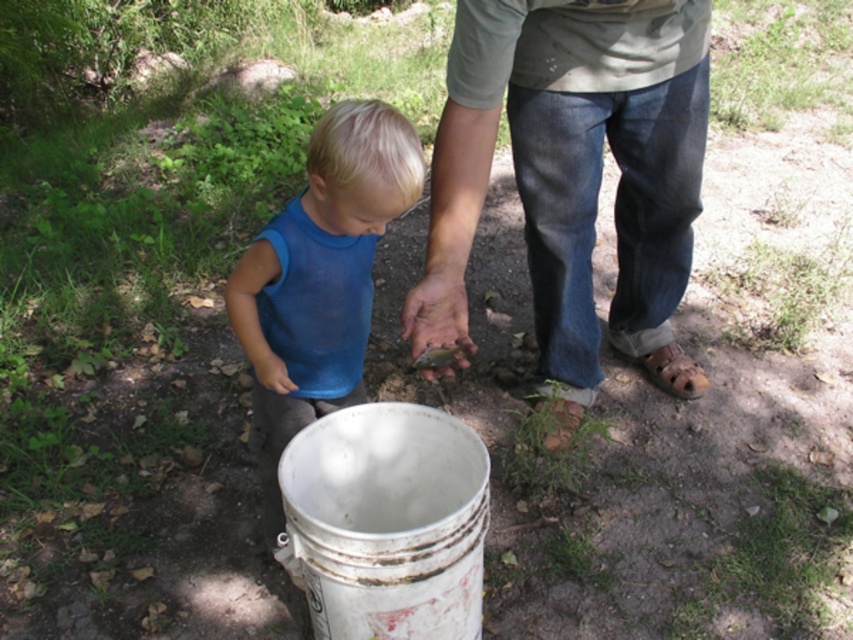
Who is taller, denim jeans at center or blue mesh shirt at center?

denim jeans at center is taller.

Describe the element at coordinates (573, 176) in the screenshot. The width and height of the screenshot is (853, 640). I see `denim jeans at center` at that location.

Find the location of a particular element. This screenshot has height=640, width=853. denim jeans at center is located at coordinates (573, 176).